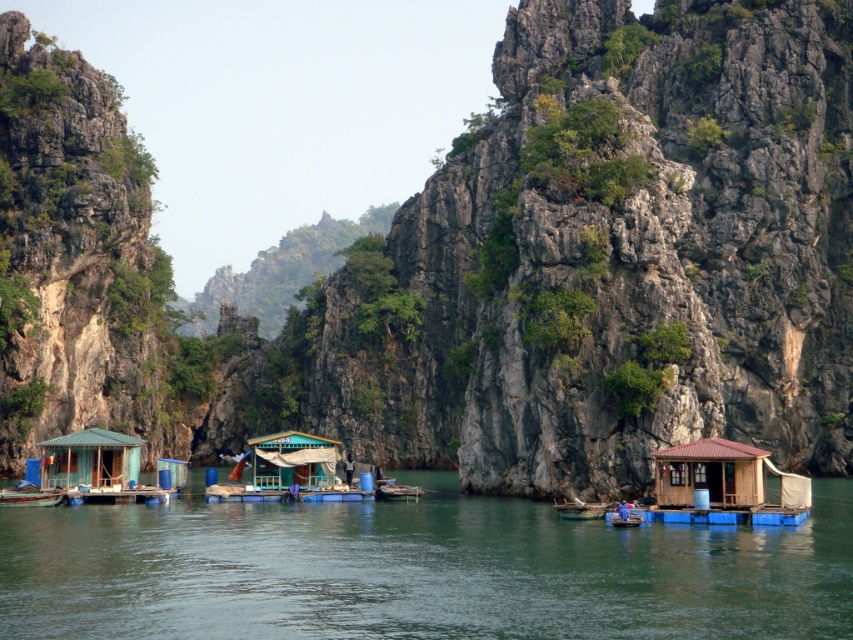
Question: Can you confirm if greenish water at center is positioned above wooden hut at center?

Choices:
 (A) yes
 (B) no

Answer: (B)

Question: Does green matte hut at lower left have a larger size compared to wooden hut at center?

Choices:
 (A) no
 (B) yes

Answer: (B)

Question: Can you confirm if greenish water at center is positioned to the left of brown wooden hut at lower right?

Choices:
 (A) yes
 (B) no

Answer: (A)

Question: Which object is the closest to the wooden boat at center?

Choices:
 (A) green matte hut at lower left
 (B) brown wooden hut at lower right
 (C) greenish water at center
 (D) wooden hut at center

Answer: (B)

Question: Which of the following is the farthest from the observer?

Choices:
 (A) (85, 445)
 (B) (553, 504)
 (C) (323, 477)

Answer: (C)

Question: Which point is closer to the camera taking this photo?

Choices:
 (A) pos(722,449)
 (B) pos(230,602)

Answer: (B)